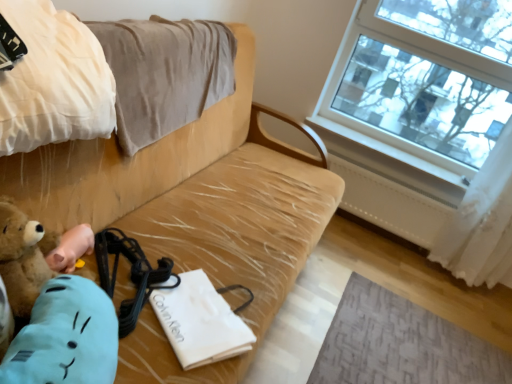
Image resolution: width=512 pixels, height=384 pixels. In order to click on blank space situated above textured gray mat at lower right (from a real-world perspective) in this screenshot , I will do `click(418, 342)`.